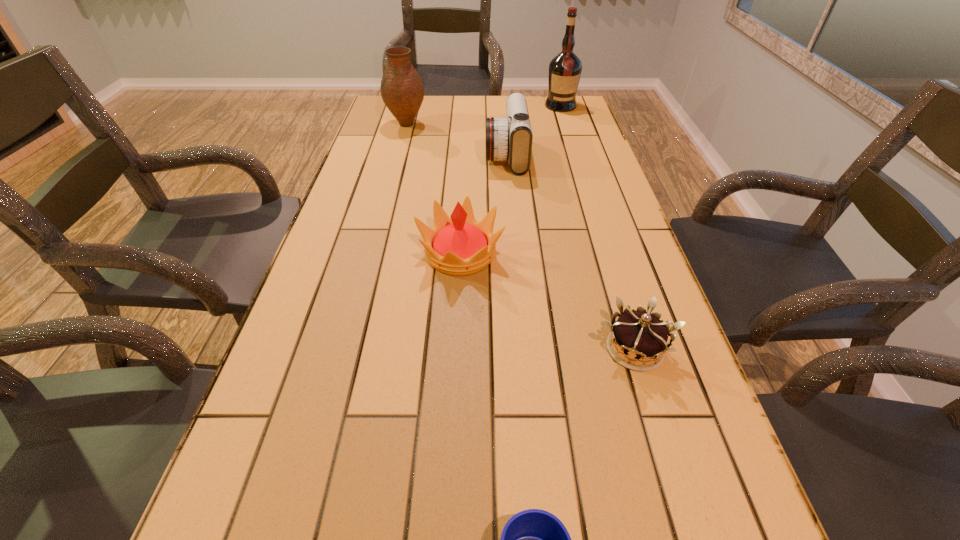
In order to click on crown at the right edge in this screenshot , I will do `click(642, 335)`.

Locate an element on the screen. The width and height of the screenshot is (960, 540). object situated at the far left corner is located at coordinates point(402,90).

Locate an element on the screen. object at the far right corner is located at coordinates (565, 69).

Find the location of `free space at the far edge of the desktop`. free space at the far edge of the desktop is located at coordinates pos(473,99).

In order to click on vacant position at the left edge of the desktop in this screenshot , I will do `click(365, 146)`.

In the image, there is a desktop. What are the coordinates of `blank space at the right edge` in the screenshot? It's located at (696, 393).

At what (x,y) coordinates should I click in order to perform the action: click on vacant space at the far right corner of the desktop. Please return your answer as a coordinate pair (x, y). Looking at the image, I should click on (584, 121).

You are a GUI agent. You are given a task and a screenshot of the screen. Output one action in this format:
    pyautogui.click(x=<x>, y=<y>)
    Task: Click on the empty space between the fourth nearest object and the shorter crown
    
    Given the screenshot: What is the action you would take?
    point(570,252)

Locate an element on the screen. The image size is (960, 540). vacant area that lies between the vase and the fourth farthest object is located at coordinates (433, 189).

Locate an element on the screen. The image size is (960, 540). vacant region between the leftmost object and the nearer crown is located at coordinates (520, 237).